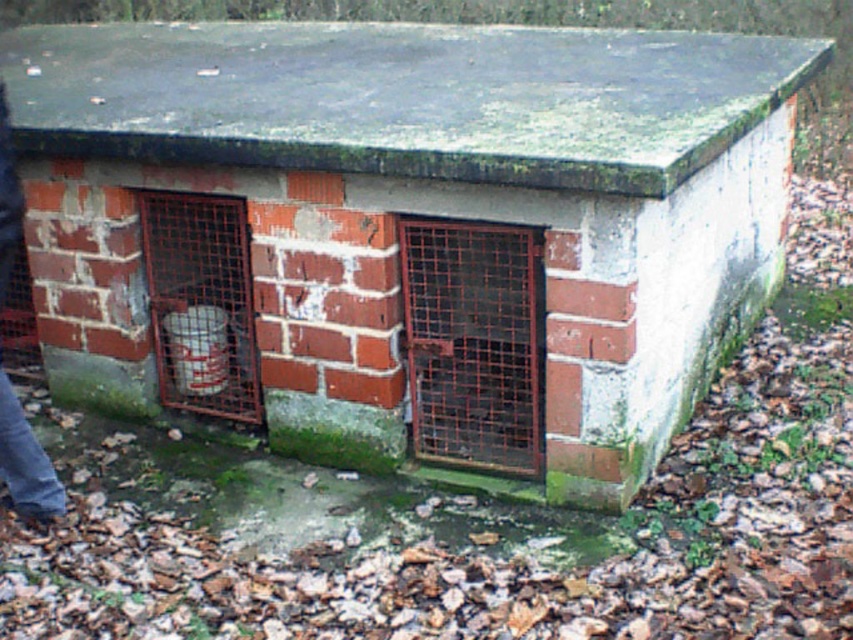
Question: Which point is farther to the camera?

Choices:
 (A) (41, 472)
 (B) (521, 326)

Answer: (B)

Question: Observing the image, what is the correct spatial positioning of rusty metal cage at center in reference to white plastic bucket at left?

Choices:
 (A) left
 (B) right

Answer: (B)

Question: Among these points, which one is farthest from the camera?

Choices:
 (A) (540, 275)
 (B) (13, 257)

Answer: (B)

Question: Is the position of rusty metal cage at center less distant than that of jeans at lower left?

Choices:
 (A) yes
 (B) no

Answer: (B)

Question: Which of the following is the closest to the observer?

Choices:
 (A) white plastic bucket at left
 (B) rusty metal cage at center
 (C) jeans at lower left

Answer: (C)

Question: Is rusty metal cage at center bigger than jeans at lower left?

Choices:
 (A) no
 (B) yes

Answer: (B)